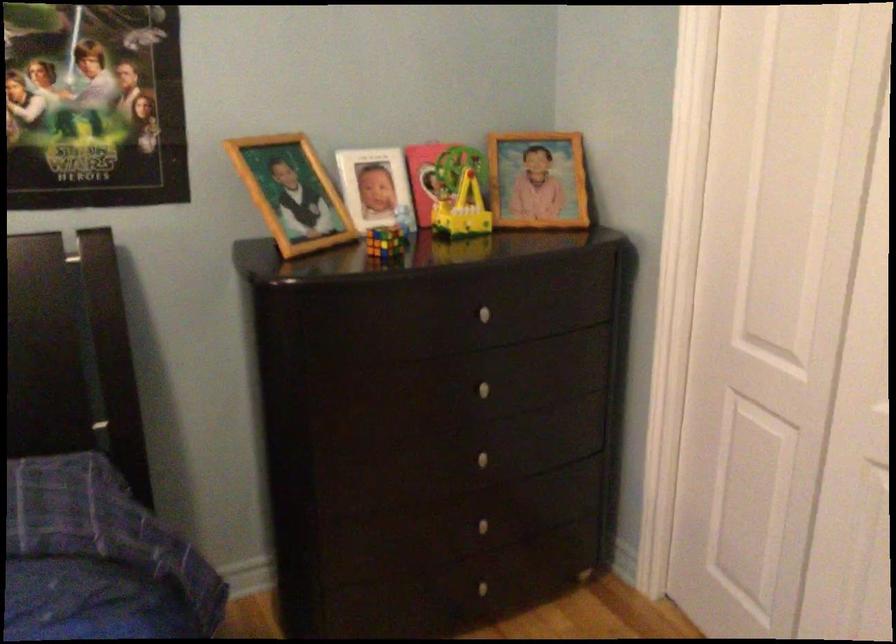
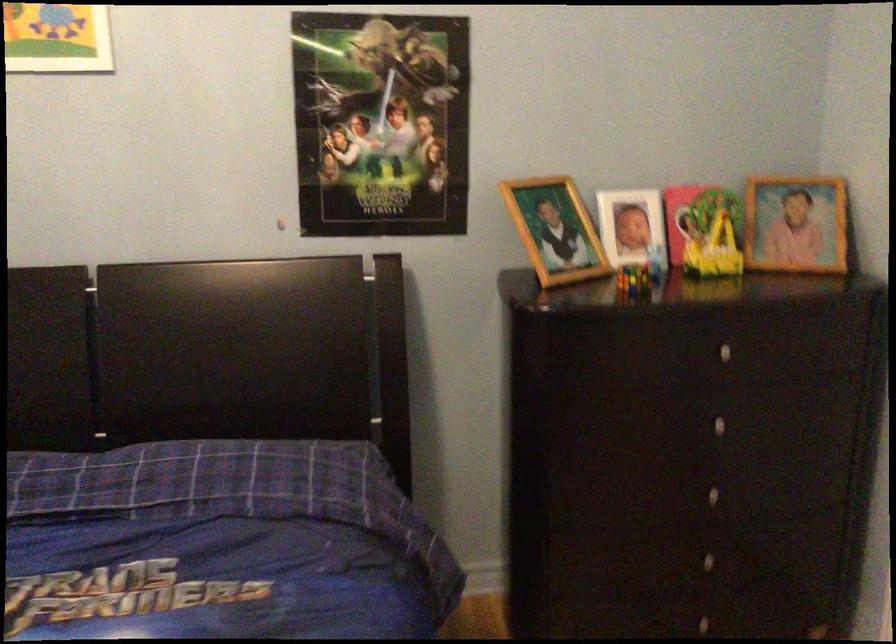
Find the pixel in the second image that matches (538,178) in the first image.

(796, 223)